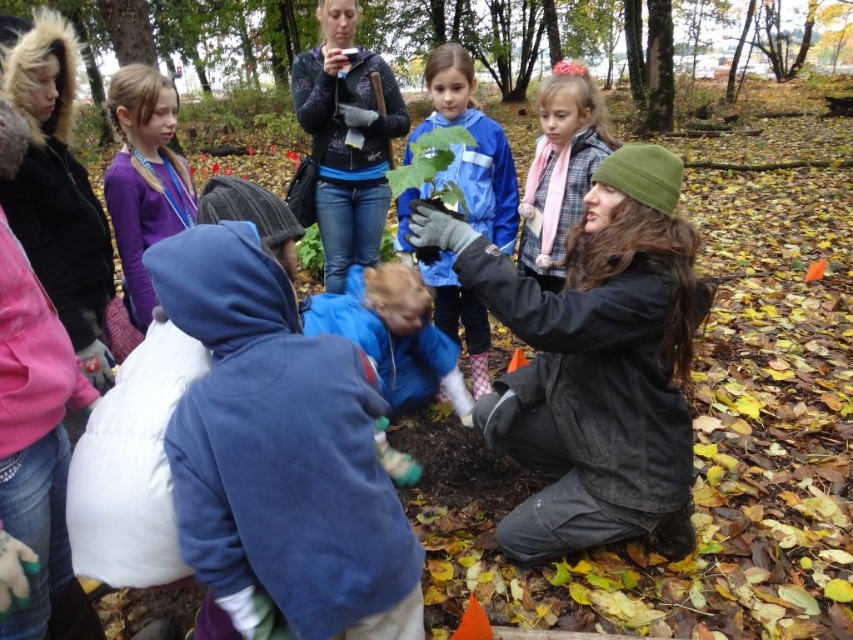
Question: Among these objects, which one is nearest to the camera?

Choices:
 (A) blue matte jacket at center
 (B) matte black jacket at center

Answer: (B)

Question: Among these objects, which one is nearest to the camera?

Choices:
 (A) green leafy plant at upper center
 (B) purple fleece jacket at upper left

Answer: (B)

Question: Is green leafy plant at upper center bigger than patterned fleece jacket at upper center?

Choices:
 (A) no
 (B) yes

Answer: (B)

Question: Is patterned fleece jacket at upper center thinner than purple fleece jacket at upper left?

Choices:
 (A) yes
 (B) no

Answer: (B)

Question: Can you confirm if green leafy plant at upper center is positioned above blue matte jacket at center?

Choices:
 (A) no
 (B) yes

Answer: (B)

Question: Estimate the real-world distances between objects in this image. Which object is farther from the matte black jacket at center?

Choices:
 (A) blue matte jacket at center
 (B) purple fleece jacket at upper left

Answer: (B)